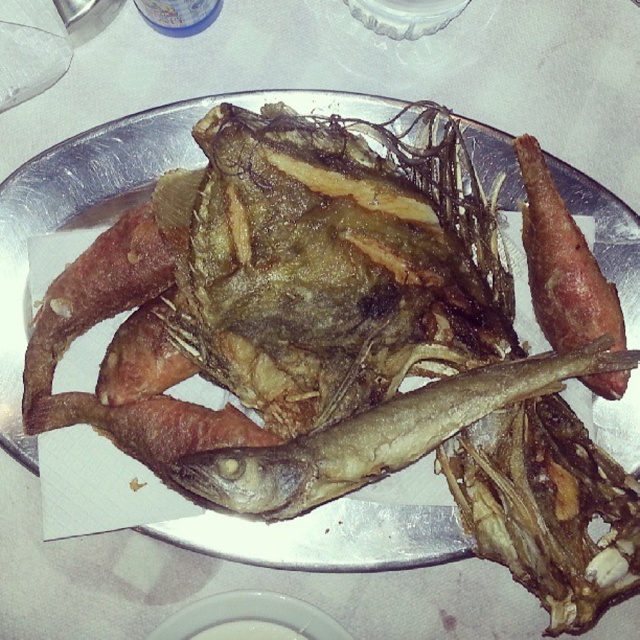
Does brown crispy bacon at right have a greater width compared to white glossy plate at center?

In fact, brown crispy bacon at right might be narrower than white glossy plate at center.

Is brown crispy bacon at right above white glossy plate at center?

Yes, brown crispy bacon at right is above white glossy plate at center.

Describe the element at coordinates (563, 262) in the screenshot. I see `brown crispy bacon at right` at that location.

Where is `brown crispy bacon at right`? The height and width of the screenshot is (640, 640). brown crispy bacon at right is located at coordinates (563, 262).

Can you confirm if brown crispy fish at center is smaller than white glossy plate at center?

No, brown crispy fish at center is not smaller than white glossy plate at center.

Is point (371, 472) positioned behind point (291, 634)?

No, it is not.

Find the location of a particular element. This screenshot has height=640, width=640. brown crispy fish at center is located at coordinates (378, 435).

How distant is brown crispy fish at center from brown crispy bacon at right?

brown crispy fish at center is 6.71 inches away from brown crispy bacon at right.

You are a GUI agent. You are given a task and a screenshot of the screen. Output one action in this format:
    pyautogui.click(x=<x>, y=<y>)
    Task: Click on the brown crispy fish at center
    
    Given the screenshot: What is the action you would take?
    pyautogui.click(x=378, y=435)

At what (x,y) coordinates should I click in order to perform the action: click on brown crispy fish at center. Please return your answer as a coordinate pair (x, y). Looking at the image, I should click on (378, 435).